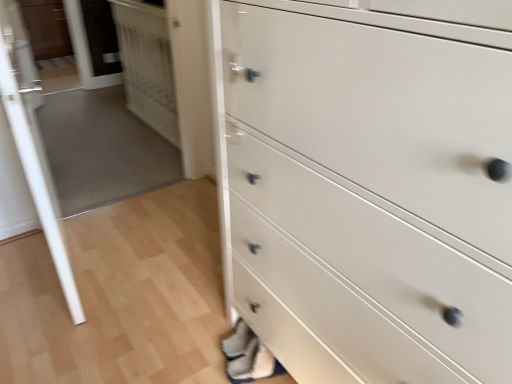
I want to click on vacant region to the left of transparent glass door at left, which appears as the 2th glass door when viewed from the back, so click(x=27, y=258).